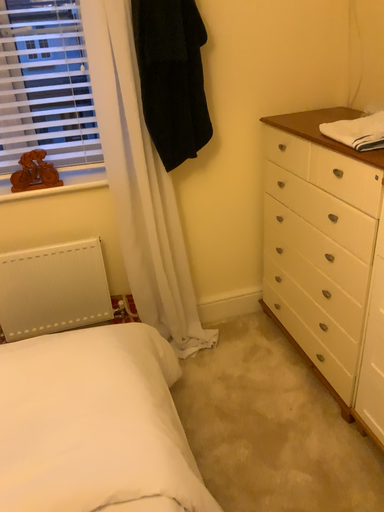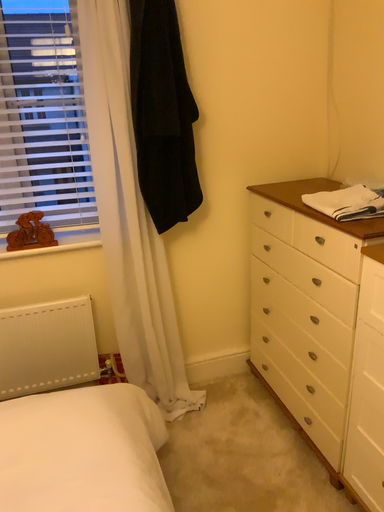
Question: Which way did the camera rotate in the video?

Choices:
 (A) rotated upward
 (B) rotated downward

Answer: (A)